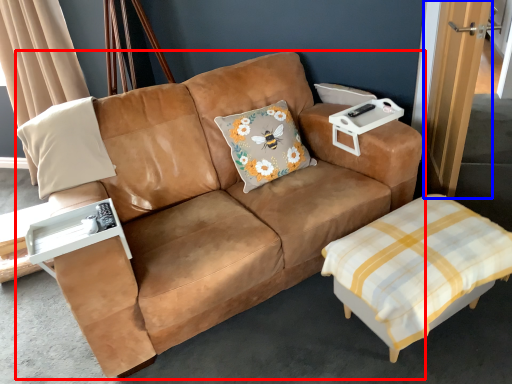
Question: Which object is further to the camera taking this photo, studio couch (highlighted by a red box) or door (highlighted by a blue box)?

Choices:
 (A) studio couch
 (B) door

Answer: (B)